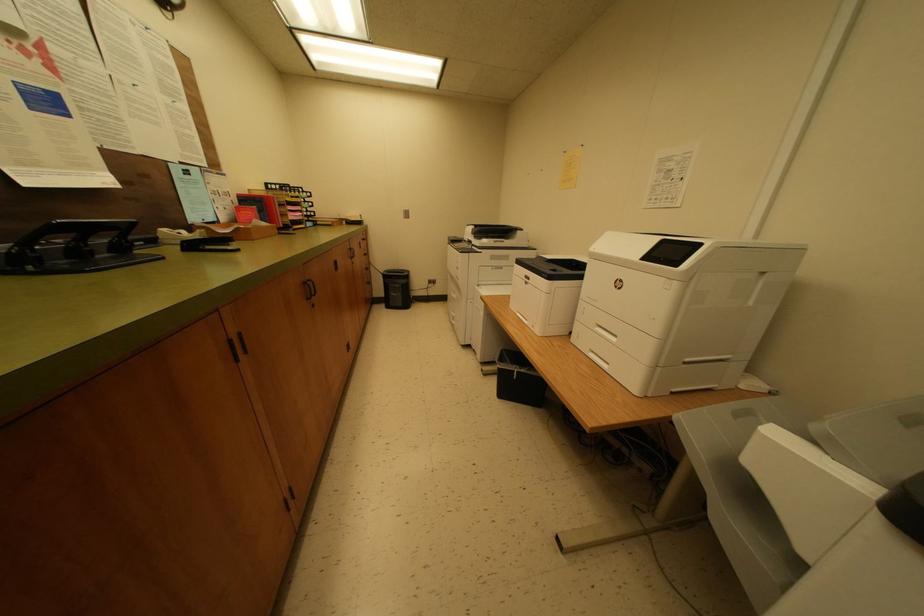
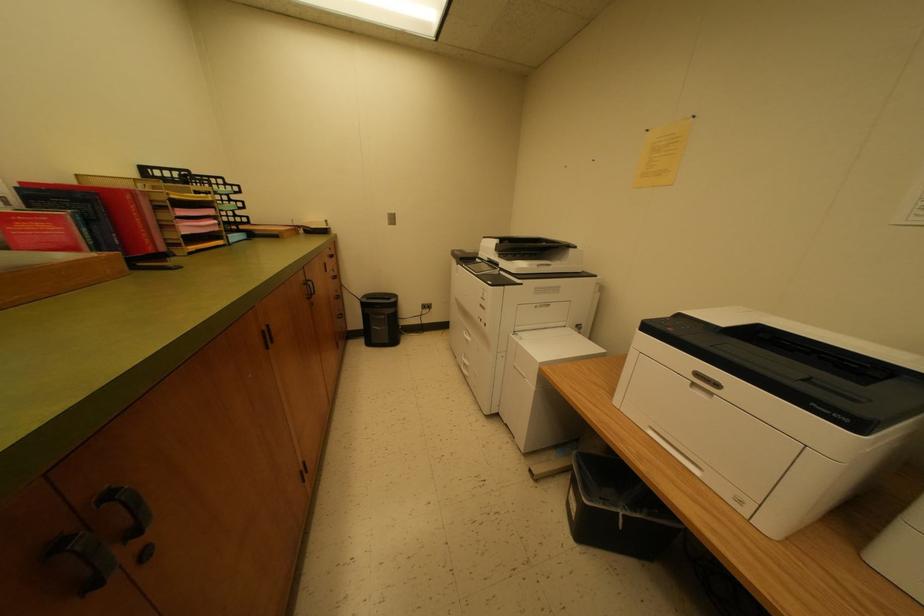
Question: Based on the continuous images, in which direction is the camera rotating? Reply with the corresponding letter.

Choices:
 (A) Left
 (B) Right
 (C) Up
 (D) Down

Answer: (B)